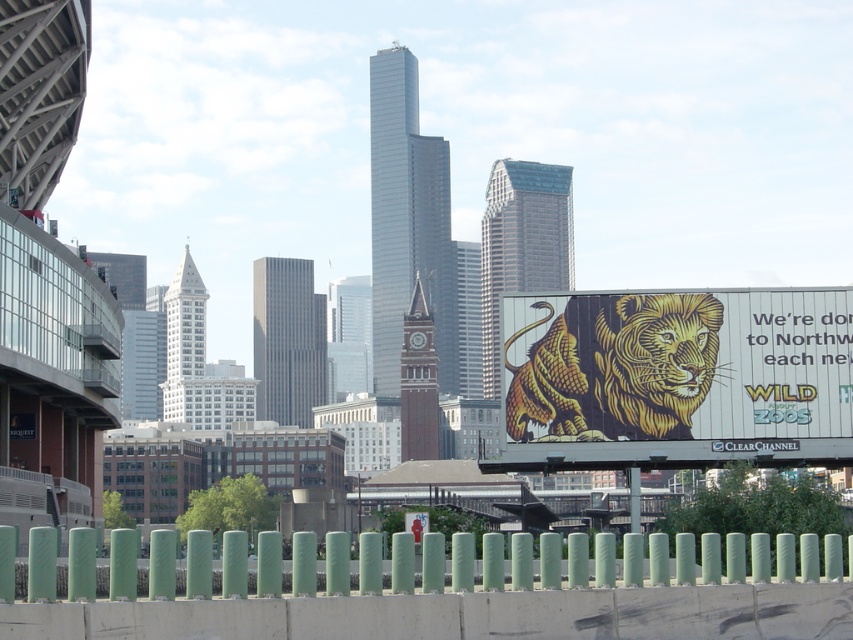
Between gold textured lion at right and green matte fence at lower center, which one is positioned higher?

gold textured lion at right is higher up.

Can you confirm if gold textured lion at right is thinner than green matte fence at lower center?

Yes.

Is point (648, 433) closer to camera compared to point (430, 589)?

No, (648, 433) is further to viewer.

The width and height of the screenshot is (853, 640). I want to click on gold textured lion at right, so click(676, 378).